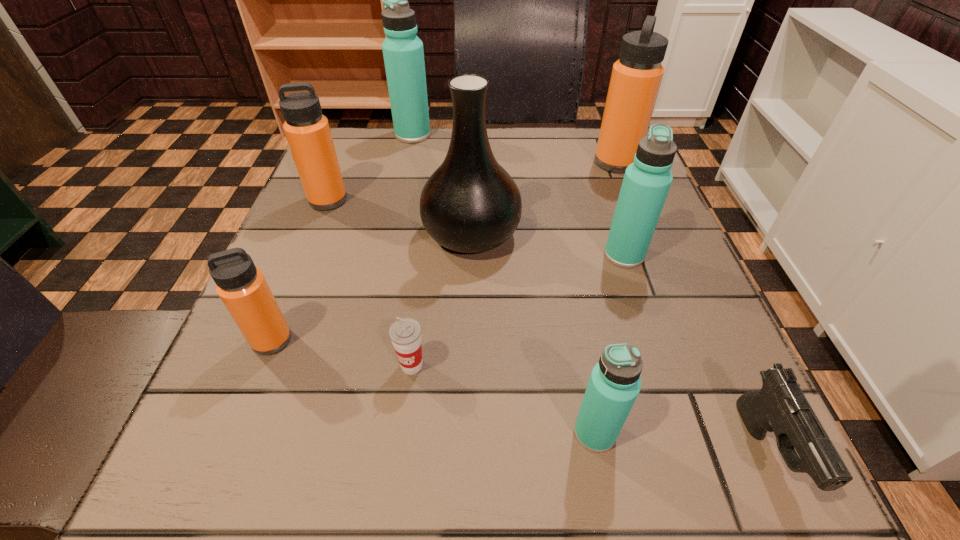
At what (x,y) coordinates should I click in order to perform the action: click on free area in between the vase and the red cup. Please return your answer as a coordinate pair (x, y). Looking at the image, I should click on (442, 300).

At what (x,y) coordinates should I click in order to perform the action: click on unoccupied position between the second biggest aqua thermos bottle and the nearest orange thermos bottle. Please return your answer as a coordinate pair (x, y). The height and width of the screenshot is (540, 960). Looking at the image, I should click on (448, 298).

Locate an element on the screen. free space between the second aqua thermos bottle from left to right and the farthest orange thermos bottle is located at coordinates (605, 298).

What are the coordinates of `free space between the vase and the second nearest aqua thermos bottle` in the screenshot? It's located at (548, 244).

The height and width of the screenshot is (540, 960). I want to click on object that is the seventh nearest to the smallest aqua thermos bottle, so click(307, 130).

Locate an element on the screen. This screenshot has width=960, height=540. object that is the sixth closest to the vase is located at coordinates (403, 53).

What are the coordinates of `thermos bottle that is the closest to the nearest aqua thermos bottle` in the screenshot? It's located at (646, 183).

Select which thermos bottle appears as the sixth closest to the red cup. Please provide its 2D coordinates. Your answer should be formatted as a tuple, i.e. [(x, y)], where the tuple contains the x and y coordinates of a point satisfying the conditions above.

[(403, 53)]

At what (x,y) coordinates should I click in order to perform the action: click on aqua thermos bottle that can be found as the closest to the red cup. Please return your answer as a coordinate pair (x, y). The image size is (960, 540). Looking at the image, I should click on (614, 384).

Image resolution: width=960 pixels, height=540 pixels. Identify the location of the closest aqua thermos bottle to the farthest thermos bottle. (646, 183).